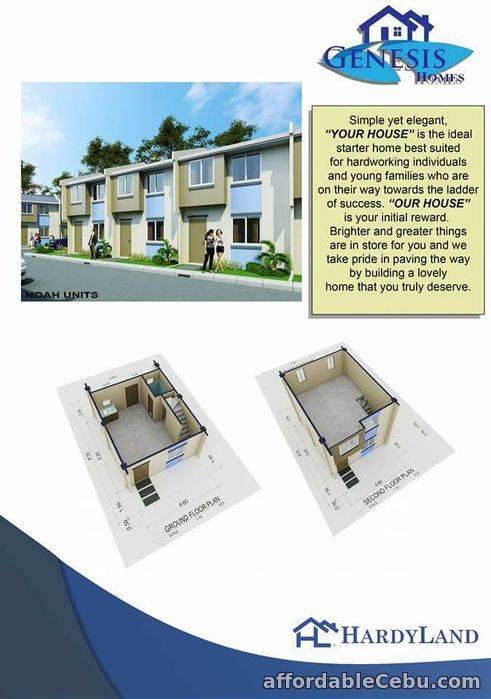
You are a GUI agent. You are given a task and a screenshot of the screen. Output one action in this format:
    pyautogui.click(x=<x>, y=<y>)
    Task: Click on the second floor layout
    
    Given the screenshot: What is the action you would take?
    pyautogui.click(x=319, y=437)